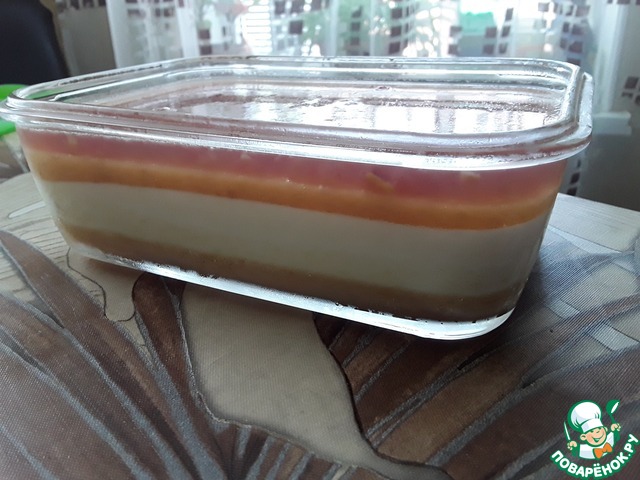
At what (x,y) coordinates should I click in order to perform the action: click on decorated table cloth. Please return your answer as a coordinate pair (x, y). Looking at the image, I should click on (36, 234), (429, 377), (178, 455).